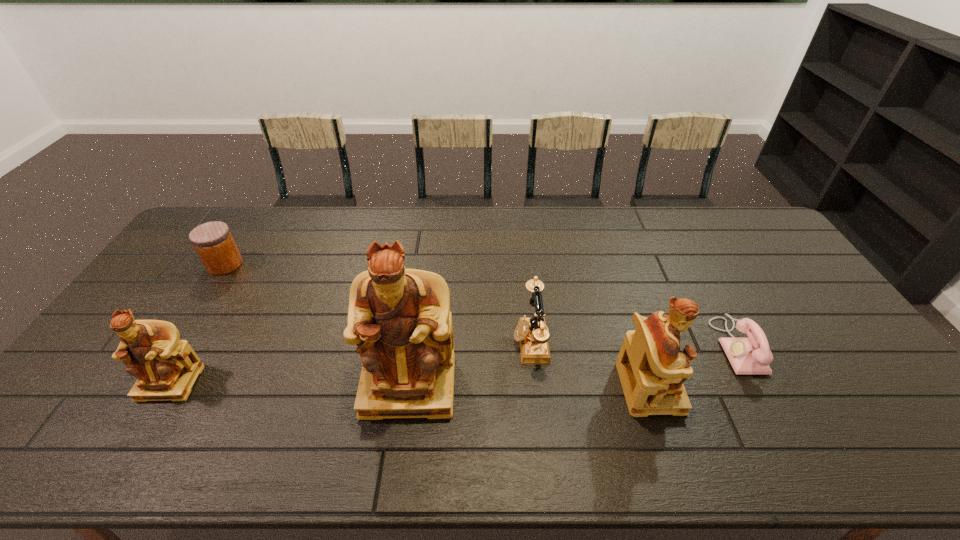
The width and height of the screenshot is (960, 540). In order to click on unoccupied area between the right telephone and the second tallest object in this screenshot , I will do `click(693, 367)`.

Where is `the third closest object to the tallest figurine`? the third closest object to the tallest figurine is located at coordinates (166, 368).

Locate which object ranks in proximity to the farthest object. Please provide its 2D coordinates. Your answer should be formatted as a tuple, i.e. [(x, y)], where the tuple contains the x and y coordinates of a point satisfying the conditions above.

[(166, 368)]

Where is `figurine that can be found as the second closest to the second object from right to left`? Image resolution: width=960 pixels, height=540 pixels. figurine that can be found as the second closest to the second object from right to left is located at coordinates (166, 368).

Choose which figurine is the third nearest neighbor to the third object from right to left. Please provide its 2D coordinates. Your answer should be formatted as a tuple, i.e. [(x, y)], where the tuple contains the x and y coordinates of a point satisfying the conditions above.

[(166, 368)]

Where is `vacant region that satisfies the following two spatial constraints: 1. on the dial of the right telephone; 2. on the front-facing side of the leftmost figurine`? This screenshot has height=540, width=960. vacant region that satisfies the following two spatial constraints: 1. on the dial of the right telephone; 2. on the front-facing side of the leftmost figurine is located at coordinates (756, 382).